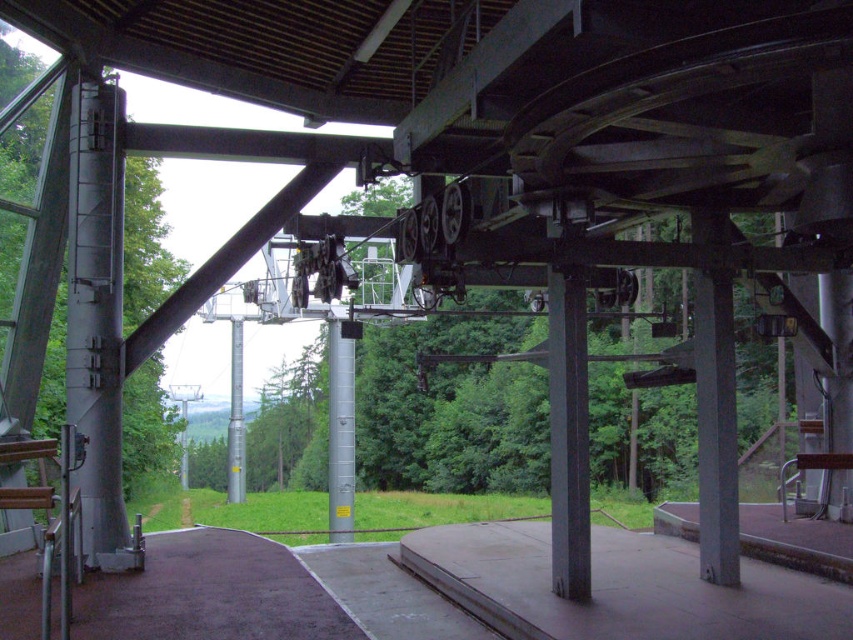
Does silver metallic pole at center have a lesser width compared to metallic pole at center?

Indeed, silver metallic pole at center has a lesser width compared to metallic pole at center.

Does silver metallic pole at center have a smaller size compared to metallic pole at center?

Actually, silver metallic pole at center might be larger than metallic pole at center.

Between point (332, 476) and point (236, 344), which one is positioned behind?

The point (236, 344) is behind.

Locate an element on the screen. This screenshot has width=853, height=640. silver metallic pole at center is located at coordinates (340, 435).